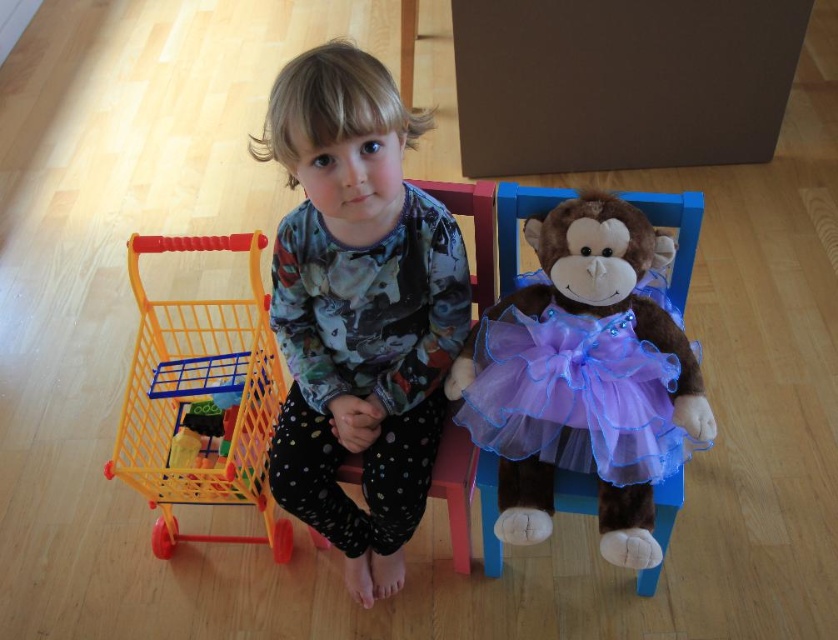
Looking at this image, is matte floral pajamas at center above yellow plastic shopping cart at left?

Yes, matte floral pajamas at center is above yellow plastic shopping cart at left.

Does matte floral pajamas at center have a greater height compared to yellow plastic shopping cart at left?

Correct, matte floral pajamas at center is much taller as yellow plastic shopping cart at left.

Which is in front, point (283, 456) or point (220, 304)?

Point (283, 456) is more forward.

Locate an element on the screen. matte floral pajamas at center is located at coordinates (358, 308).

Is purple tulle monkey at center shorter than yellow plastic shopping cart at left?

Yes, purple tulle monkey at center is shorter than yellow plastic shopping cart at left.

Can you confirm if purple tulle monkey at center is wider than yellow plastic shopping cart at left?

In fact, purple tulle monkey at center might be narrower than yellow plastic shopping cart at left.

Who is more forward, (635, 506) or (234, 316)?

Point (635, 506)

At what (x,y) coordinates should I click in order to perform the action: click on purple tulle monkey at center. Please return your answer as a coordinate pair (x, y). The image size is (838, 640). Looking at the image, I should click on (583, 378).

Between point (288, 259) and point (645, 541), which one is positioned behind?

The point (288, 259) is behind.

Is matte floral pajamas at center further to camera compared to purple tulle monkey at center?

That is False.

The height and width of the screenshot is (640, 838). In order to click on matte floral pajamas at center in this screenshot , I will do `click(358, 308)`.